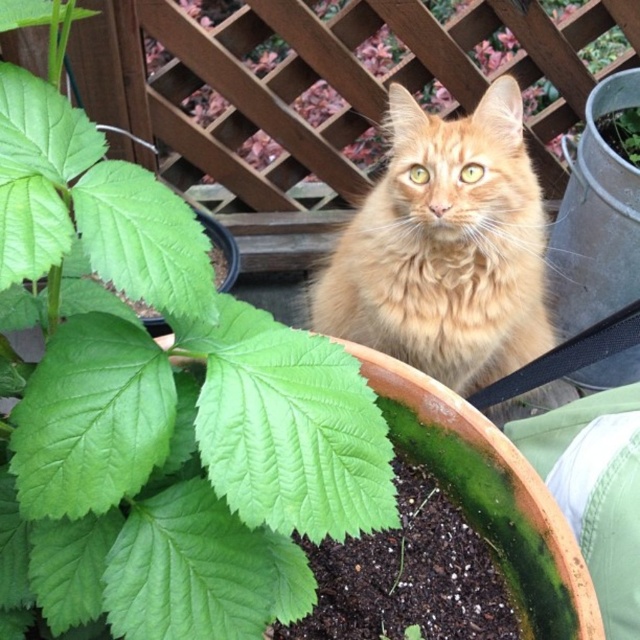
You are a botanist examining the garden scene. You notice a specific point in the image at coordinates [156,408]. What object is located at this point?

The point at coordinates [156,408] corresponds to the green matte leaf at center.

You are taking a photo of the ginger cat in the garden. You want to focus on the point closer to the camera between point (276,358) and point (449,381). Which point should you choose?

Point (276,358) is closer to the camera than point (449,381), so you should choose point (276,358) to focus on.

What is the exact coordinate of the green matte leaf at center?

The green matte leaf at center is located at point [156,408].